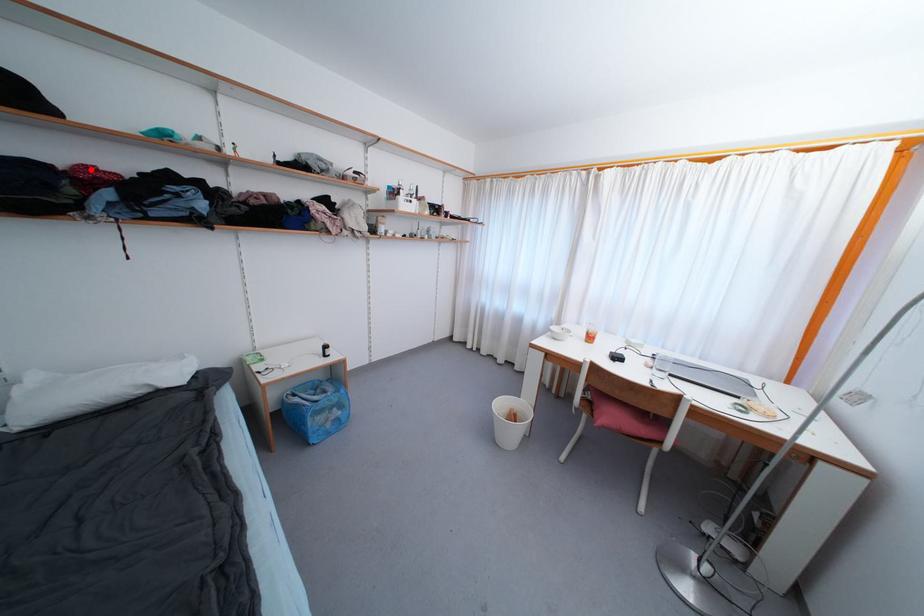
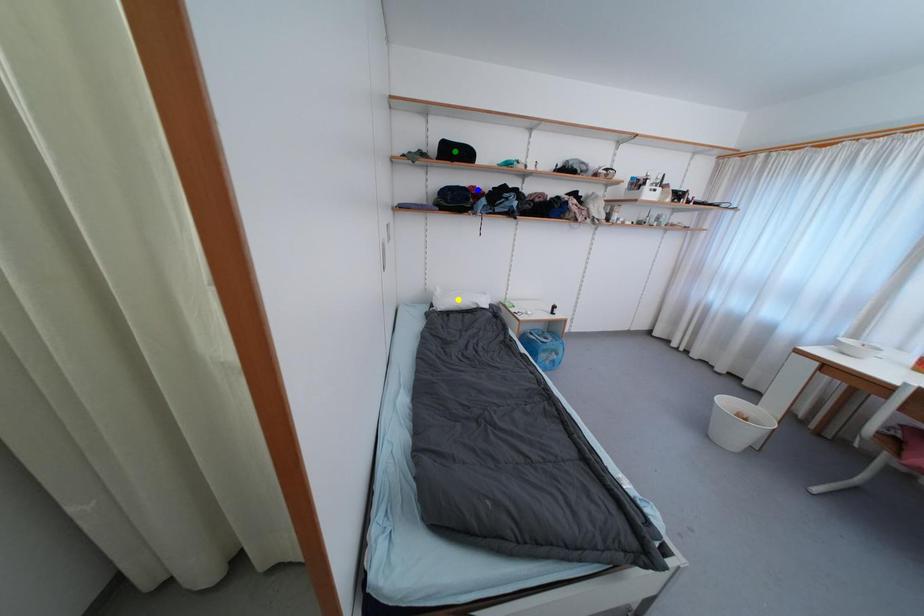
Question: I am providing you with two images of the same scene from different viewpoints. A red point is marked on the first image. You are given multiple points on the second image. Which point in image 2 is actually the same real-world point as the red point in image 1?

Choices:
 (A) green point
 (B) blue point
 (C) yellow point

Answer: (B)